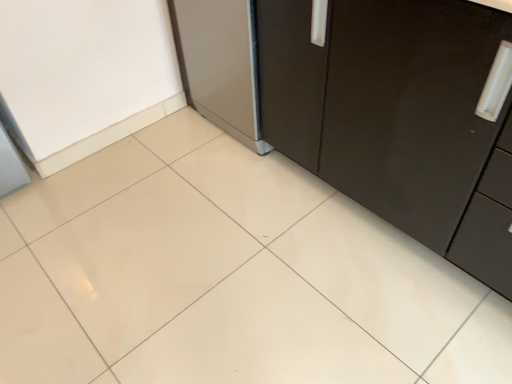
Question: Relative to satin silver refrigerator at center, is matte black cabinet at center in front or behind?

Choices:
 (A) behind
 (B) front

Answer: (B)

Question: Would you say matte black cabinet at center is to the left or to the right of satin silver refrigerator at center in the picture?

Choices:
 (A) right
 (B) left

Answer: (A)

Question: Choose the correct answer: Is matte black cabinet at center inside satin silver refrigerator at center or outside it?

Choices:
 (A) inside
 (B) outside

Answer: (B)

Question: From the image's perspective, relative to matte black cabinet at center, is satin silver refrigerator at center above or below?

Choices:
 (A) above
 (B) below

Answer: (A)

Question: Considering their positions, is satin silver refrigerator at center located in front of or behind matte black cabinet at center?

Choices:
 (A) behind
 (B) front

Answer: (A)

Question: Is satin silver refrigerator at center situated inside matte black cabinet at center or outside?

Choices:
 (A) outside
 (B) inside

Answer: (A)

Question: Looking at their shapes, would you say satin silver refrigerator at center is wider or thinner than matte black cabinet at center?

Choices:
 (A) thin
 (B) wide

Answer: (A)